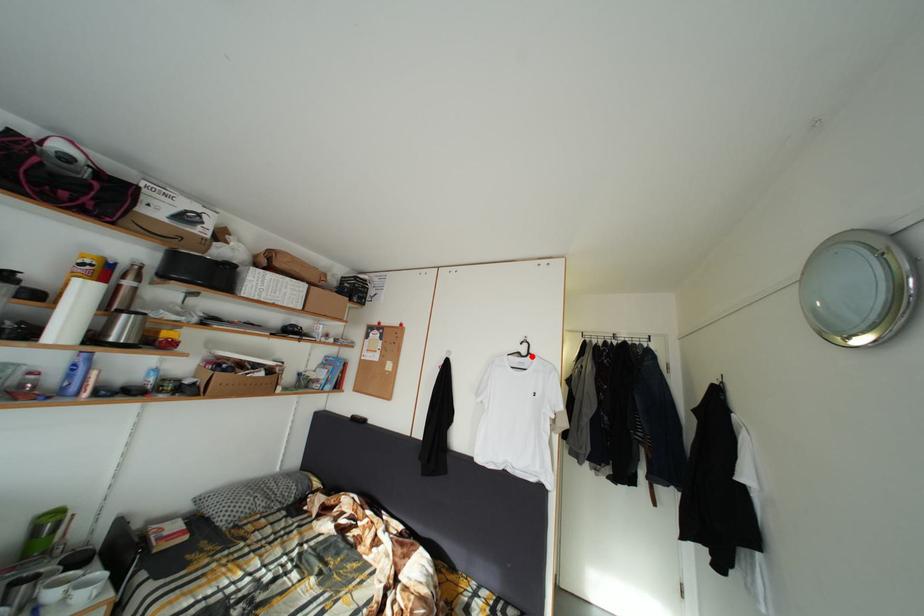
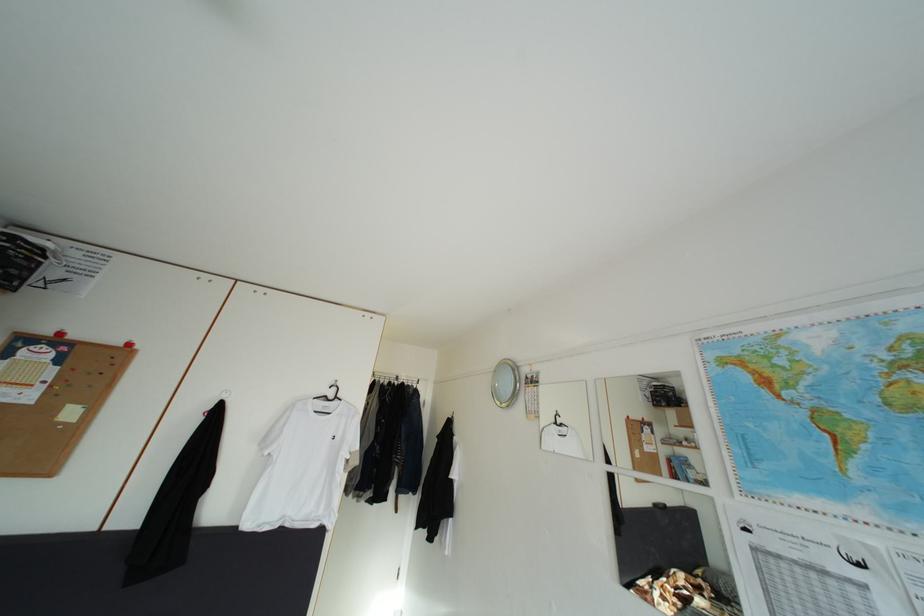
Question: I am providing you with two images of the same scene from different viewpoints. Image1 has a red point marked. In image2, the corresponding 3D location appears at what relative position? Reply with the corresponding letter.

Choices:
 (A) Closer
 (B) Farther

Answer: (B)